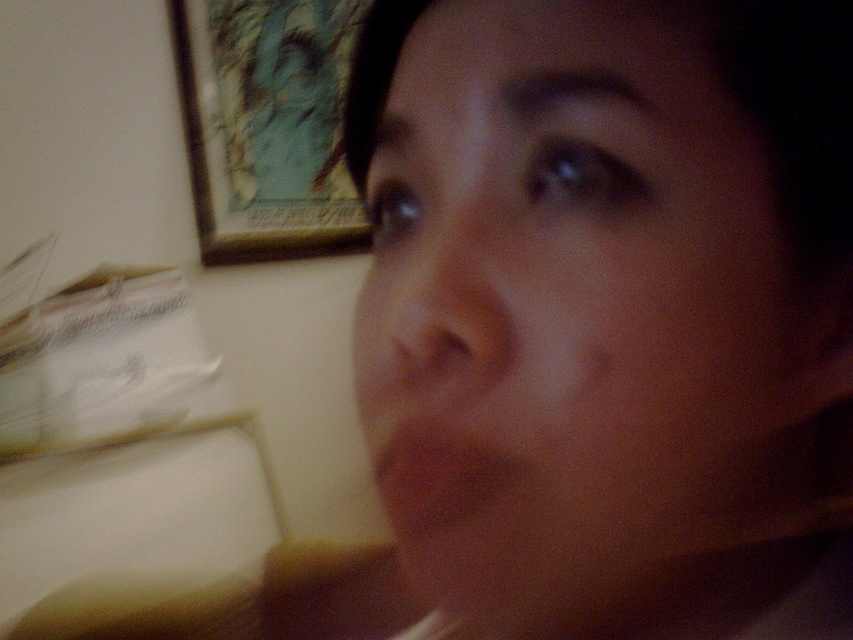
You are a photographer adjusting your camera settings to capture a clear shot of the smooth skin face at center and the wooden framed artwork at upper left. Given the current focus on the face, would the artwork be in focus if you move the camera 2 feet closer to the face?

The distance between the smooth skin face at center and wooden framed artwork at upper left is 5.34 feet. Moving the camera 2 feet closer to the face would reduce the distance to 3.34 feet. However, the depth of field might still keep the artwork in focus depending on aperture and lens settings, but the question doesn

You are standing in the room where the selfie was taken. You notice two points marked in the image. The first point is at coordinates point [376,449], and the second is at point [305,112]. Which of these two points is closer to you, the observer?

Point [376,449] is in front of point [305,112], so it is closer to you.